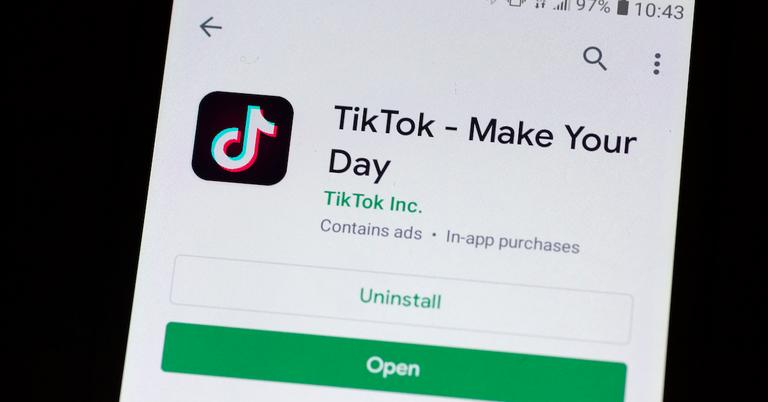
This screenshot has width=768, height=402. Identify the location of clock. (672, 11).